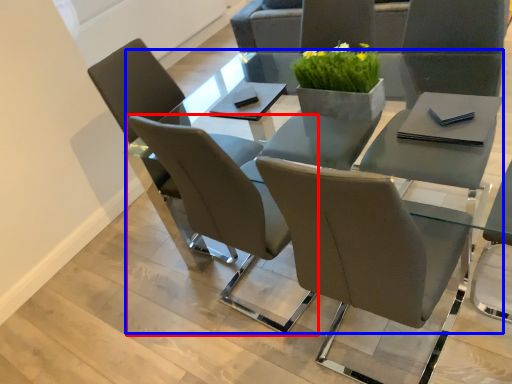
Question: Which object appears closest to the camera in this image, chair (highlighted by a red box) or round table (highlighted by a blue box)?

Choices:
 (A) chair
 (B) round table

Answer: (B)